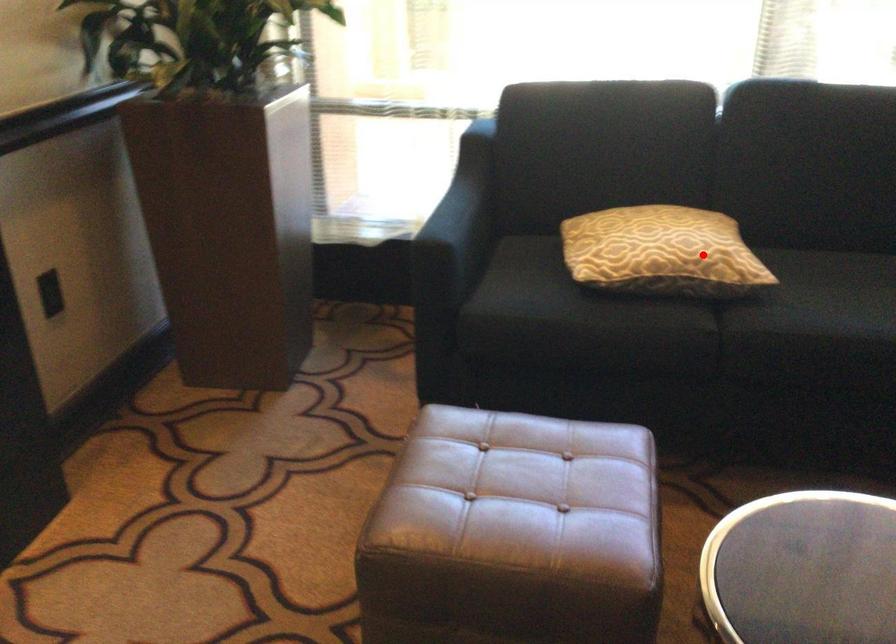
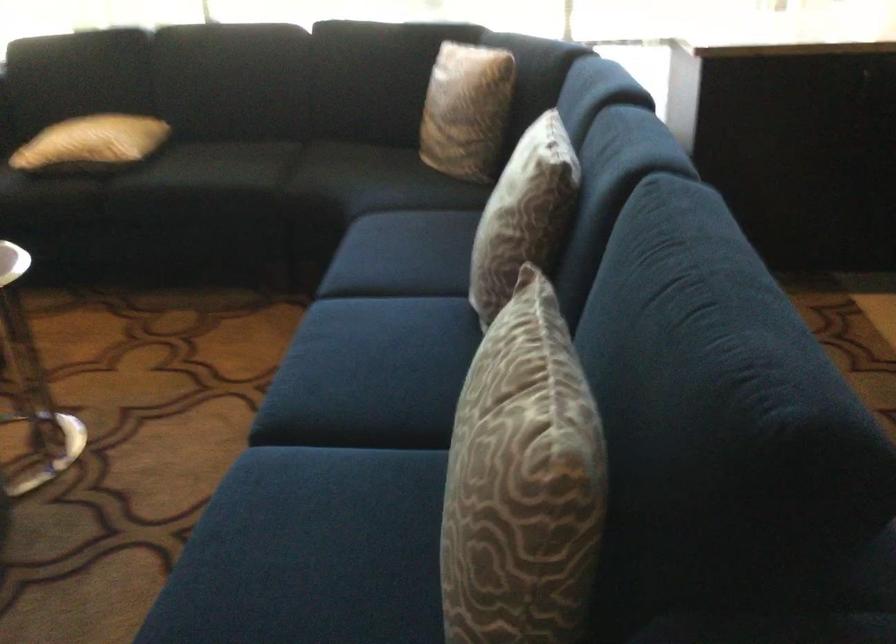
Locate, in the second image, the point that corresponds to the highlighted location in the first image.

(91, 142)